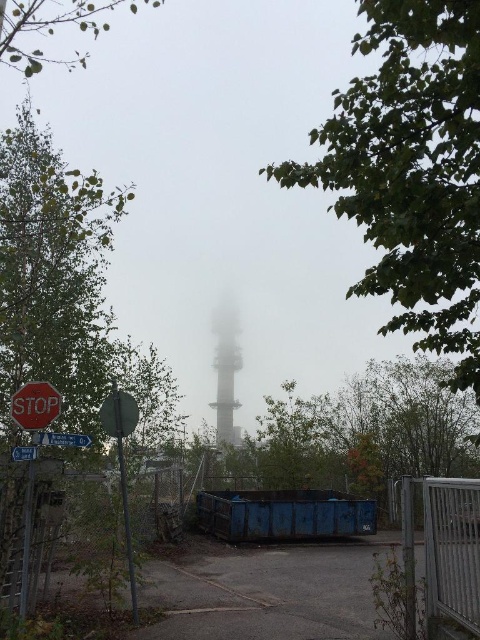
Question: Can you confirm if green leafy tree at upper center is bigger than smooth gray tower at center?

Choices:
 (A) no
 (B) yes

Answer: (B)

Question: Which object is farther from the camera taking this photo?

Choices:
 (A) blue plastic sign at lower left
 (B) green leafy tree at left
 (C) red plastic stop sign at left

Answer: (A)

Question: Can you confirm if metallic gate at lower right is positioned above smooth gray tower at center?

Choices:
 (A) no
 (B) yes

Answer: (B)

Question: Which object is positioned farthest from the red plastic stop sign at left?

Choices:
 (A) green leafy tree at upper center
 (B) red matte stop sign at lower left
 (C) green leafy tree at center
 (D) smooth gray tower at center

Answer: (D)

Question: Based on their relative distances, which object is nearer to the red plastic stop sign at left?

Choices:
 (A) red matte stop sign at lower left
 (B) green leafy tree at center
 (C) blue plastic sign at lower left
 (D) green leafy tree at upper left

Answer: (C)

Question: Where is green leafy tree at upper center located in relation to red matte stop sign at lower left in the image?

Choices:
 (A) below
 (B) above

Answer: (B)